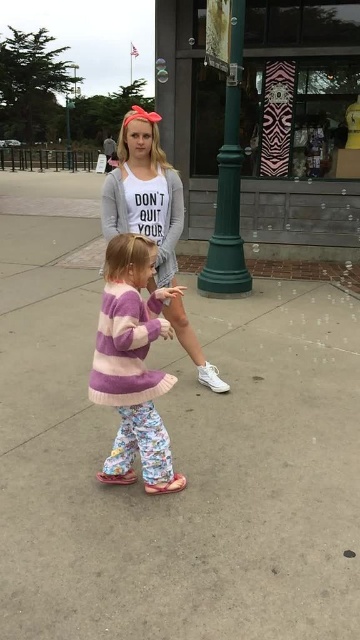
You are a photographer trying to capture a photo of the purple knit sweater at center and the green metal pole at upper center. Based on their positions, which object is closer to the camera?

The purple knit sweater at center is closer to the camera because it is positioned below the green metal pole at upper center, indicating it is in a lower plane relative to the camera.

You are a photographer trying to capture both the purple knit sweater at center and the green metal pole at upper center in a single frame. Based on their sizes, which object will appear smaller in the photo?

The purple knit sweater at center will appear smaller in the photo because it has a lesser width compared to the green metal pole at upper center.

You are a delivery person trying to deliver a package to the address shown in the image. The package requires a space that is at least as wide as the matte gray sweatshirt at center. Is the green matte pole at center wide enough to place the package?

The matte gray sweatshirt at center might be wider than green matte pole at center, so it is uncertain if the green matte pole at center is wide enough to place the package. Check the width of the pole first.